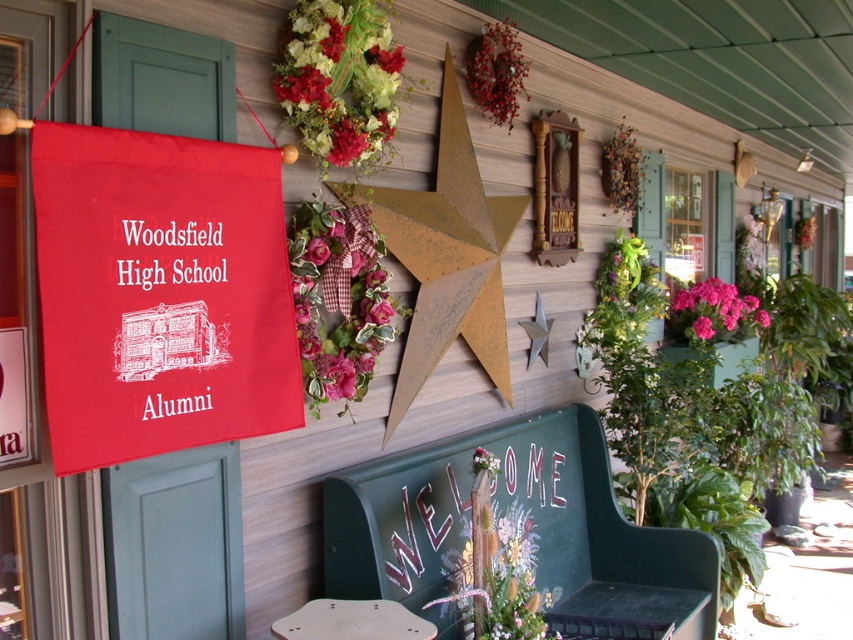
Who is positioned more to the left, rustic wood star at center or light brown wooden stool at center?

Positioned to the left is light brown wooden stool at center.

Does rustic wood star at center have a lesser height compared to light brown wooden stool at center?

Incorrect, rustic wood star at center's height does not fall short of light brown wooden stool at center's.

Measure the distance between rustic wood star at center and camera.

rustic wood star at center and camera are 2.48 meters apart.

Locate an element on the screen. rustic wood star at center is located at coordinates (445, 256).

Who is shorter, matte fabric banner at left or rustic wood star at center?

matte fabric banner at left

Measure the distance between matte fabric banner at left and camera.

matte fabric banner at left and camera are 1.65 meters apart.

Describe the element at coordinates (160, 292) in the screenshot. I see `matte fabric banner at left` at that location.

This screenshot has height=640, width=853. Identify the location of matte fabric banner at left. (160, 292).

Can you confirm if floral bouquet at upper center is bigger than light brown wooden stool at center?

Yes.

Locate an element on the screen. floral bouquet at upper center is located at coordinates (339, 80).

Locate an element on the screen. floral bouquet at upper center is located at coordinates (339, 80).